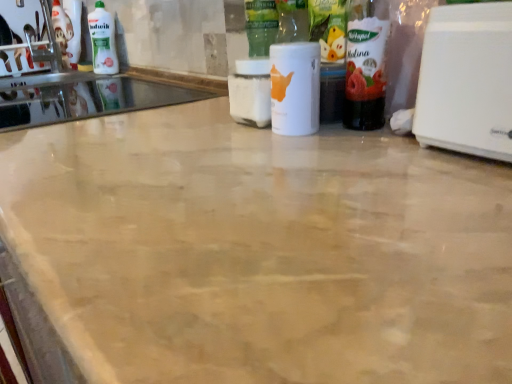
Question: Is white matte bottle at center, the first bottle viewed from the left, next to white plastic toaster at right?

Choices:
 (A) yes
 (B) no

Answer: (B)

Question: Considering the relative sizes of white matte bottle at center, the 2th bottle when ordered from right to left, and white plastic toaster at right in the image provided, is white matte bottle at center, the 2th bottle when ordered from right to left, taller than white plastic toaster at right?

Choices:
 (A) yes
 (B) no

Answer: (B)

Question: Is white matte bottle at center, the 2th bottle when ordered from right to left, thinner than white plastic toaster at right?

Choices:
 (A) yes
 (B) no

Answer: (A)

Question: Is white plastic toaster at right located within white matte bottle at center, the 2th bottle when ordered from right to left?

Choices:
 (A) no
 (B) yes

Answer: (A)

Question: From a real-world perspective, is white matte bottle at center, the first bottle viewed from the left, positioned over white plastic toaster at right based on gravity?

Choices:
 (A) no
 (B) yes

Answer: (A)

Question: Is white matte bottle at center, the first bottle viewed from the left, closer to the viewer compared to white plastic toaster at right?

Choices:
 (A) no
 (B) yes

Answer: (A)

Question: Is translucent plastic bottle at right, which is the second bottle from left to right, closer to camera compared to white glossy bottle at upper left?

Choices:
 (A) no
 (B) yes

Answer: (B)

Question: Is translucent plastic bottle at right, which appears as the 1th bottle when viewed from the right, smaller than white glossy bottle at upper left?

Choices:
 (A) no
 (B) yes

Answer: (B)

Question: Is translucent plastic bottle at right, which appears as the 1th bottle when viewed from the right, next to white glossy bottle at upper left?

Choices:
 (A) no
 (B) yes

Answer: (A)

Question: Considering the relative sizes of translucent plastic bottle at right, which is the second bottle from left to right, and white glossy bottle at upper left in the image provided, is translucent plastic bottle at right, which is the second bottle from left to right, taller than white glossy bottle at upper left?

Choices:
 (A) yes
 (B) no

Answer: (A)

Question: Is translucent plastic bottle at right, which appears as the 1th bottle when viewed from the right, positioned beyond the bounds of white glossy bottle at upper left?

Choices:
 (A) yes
 (B) no

Answer: (A)

Question: Is translucent plastic bottle at right, which is the second bottle from left to right, shorter than white glossy bottle at upper left?

Choices:
 (A) no
 (B) yes

Answer: (A)

Question: Is white glossy sink at upper left wider than white matte bottle at center, the 2th bottle when ordered from right to left?

Choices:
 (A) yes
 (B) no

Answer: (A)